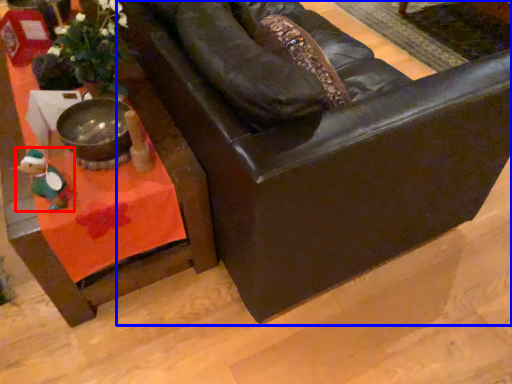
Question: Which point is further to the camera, toy (highlighted by a red box) or chair (highlighted by a blue box)?

Choices:
 (A) toy
 (B) chair

Answer: (A)